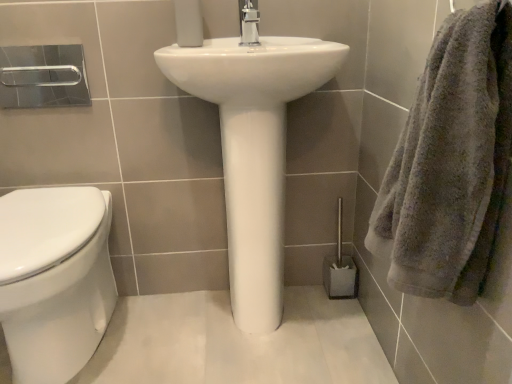
Consider the image. In order to face white glossy toilet at left, should I rotate leftwards or rightwards?

You should look left and rotate roughly 27.112 degrees.

At what (x,y) coordinates should I click in order to perform the action: click on white glossy sink at center. Please return your answer as a coordinate pair (x, y). The height and width of the screenshot is (384, 512). Looking at the image, I should click on (253, 149).

The image size is (512, 384). What do you see at coordinates (340, 269) in the screenshot? I see `gray plastic toilet brush at lower right` at bounding box center [340, 269].

Where is `white matte toilet paper at upper center`? white matte toilet paper at upper center is located at coordinates (188, 23).

You are a GUI agent. You are given a task and a screenshot of the screen. Output one action in this format:
    pyautogui.click(x=<x>, y=<y>)
    Task: Click on the polished chrome faucet at center
    Image resolution: width=512 pixels, height=384 pixels.
    Given the screenshot: What is the action you would take?
    pyautogui.click(x=249, y=22)

Are gray fluffy towel at right and white glossy toilet at left beside each other?

They are not placed beside each other.

Can you confirm if gray fluffy towel at right is positioned to the left of white glossy toilet at left?

No.

Is gray fluffy towel at right thinner than white glossy toilet at left?

Indeed, gray fluffy towel at right has a lesser width compared to white glossy toilet at left.

Could you tell me if gray fluffy towel at right is facing white glossy toilet at left?

No, gray fluffy towel at right is not turned towards white glossy toilet at left.

Is white glossy sink at center turned away from white glossy toilet at left?

No, white glossy sink at center is not facing away from white glossy toilet at left.

Considering the relative positions of white glossy sink at center and white glossy toilet at left in the image provided, is white glossy sink at center behind white glossy toilet at left?

Yes.

Can we say white glossy sink at center lies outside white glossy toilet at left?

Yes, white glossy sink at center is located beyond the bounds of white glossy toilet at left.

Is there a large distance between white glossy sink at center and white glossy toilet at left?

No, white glossy sink at center is not far from white glossy toilet at left.

Is white glossy toilet at left completely or partially outside of gray fluffy towel at right?

Indeed, white glossy toilet at left is completely outside gray fluffy towel at right.

From a real-world perspective, is white glossy toilet at left above or below gray fluffy towel at right?

In terms of real-world spatial position, white glossy toilet at left is below gray fluffy towel at right.

Are white glossy toilet at left and gray fluffy towel at right located far from each other?

No, there isn't a large distance between white glossy toilet at left and gray fluffy towel at right.

The width and height of the screenshot is (512, 384). I want to click on towel above the white glossy toilet at left (from the image's perspective), so click(451, 162).

Is white glossy sink at center positioned before gray fluffy towel at right?

No, the depth of white glossy sink at center is greater than that of gray fluffy towel at right.

Between white glossy sink at center and gray fluffy towel at right, which one appears on the left side from the viewer's perspective?

white glossy sink at center is more to the left.

Consider the image. Can gray fluffy towel at right be found inside white glossy sink at center?

That's incorrect, gray fluffy towel at right is not inside white glossy sink at center.

Consider the image. Can you tell me how much white glossy sink at center and gray fluffy towel at right differ in facing direction?

88.5 degrees.

Considering the relative positions of white matte toilet paper at upper center and white glossy toilet at left in the image provided, is white matte toilet paper at upper center to the right of white glossy toilet at left from the viewer's perspective?

Yes, white matte toilet paper at upper center is to the right of white glossy toilet at left.

Is white matte toilet paper at upper center positioned with its back to white glossy toilet at left?

No, white matte toilet paper at upper center's orientation is not away from white glossy toilet at left.

From the image's perspective, relative to white glossy toilet at left, is white matte toilet paper at upper center above or below?

white matte toilet paper at upper center is situated higher than white glossy toilet at left in the image.

Looking at this image, is white matte toilet paper at upper center positioned behind white glossy toilet at left?

Yes, the depth of white matte toilet paper at upper center is greater than that of white glossy toilet at left.

Is gray fluffy towel at right placed right next to polished chrome faucet at center?

No, gray fluffy towel at right is not next to polished chrome faucet at center.

From a real-world perspective, is gray fluffy towel at right positioned under polished chrome faucet at center based on gravity?

Correct, in the physical world, gray fluffy towel at right is lower than polished chrome faucet at center.

Locate an element on the screen. towel that appears below the polished chrome faucet at center (from the image's perspective) is located at coordinates (451, 162).

Which object is positioned more to the left, gray fluffy towel at right or polished chrome faucet at center?

From the viewer's perspective, polished chrome faucet at center appears more on the left side.

Find the location of a particular element. This screenshot has height=384, width=512. sink that appears below the polished chrome faucet at center (from a real-world perspective) is located at coordinates (253, 149).

Is polished chrome faucet at center completely or partially outside of white glossy sink at center?

Yes, polished chrome faucet at center is outside of white glossy sink at center.

Considering the relative positions of polished chrome faucet at center and white glossy sink at center in the image provided, is polished chrome faucet at center to the left of white glossy sink at center from the viewer's perspective?

Yes.

Locate an element on the screen. towel located above the white glossy toilet at left (from the image's perspective) is located at coordinates (451, 162).

The height and width of the screenshot is (384, 512). What are the coordinates of `sink that is above the white glossy toilet at left (from a real-world perspective)` in the screenshot? It's located at (253, 149).

Looking at the image, which one is located further to gray plastic toilet brush at lower right, polished chrome faucet at center or white glossy toilet at left?

Among the two, white glossy toilet at left is located further to gray plastic toilet brush at lower right.

Considering their positions, is white glossy toilet at left positioned further to white glossy sink at center than white matte toilet paper at upper center?

The object further to white glossy sink at center is white glossy toilet at left.

Which object lies nearer to the anchor point white glossy sink at center, white matte toilet paper at upper center or white glossy toilet at left?

white matte toilet paper at upper center is closer to white glossy sink at center.

Based on their spatial positions, is white matte toilet paper at upper center or polished chrome faucet at center closer to white glossy toilet at left?

The object closer to white glossy toilet at left is white matte toilet paper at upper center.

From the image, which object appears to be nearer to white glossy toilet at left, white glossy sink at center or polished chrome faucet at center?

white glossy sink at center is closer to white glossy toilet at left.

From the image, which object appears to be nearer to polished chrome faucet at center, white glossy toilet at left or gray plastic toilet brush at lower right?

gray plastic toilet brush at lower right lies closer to polished chrome faucet at center than the other object.

Considering their positions, is gray fluffy towel at right positioned further to polished chrome faucet at center than white matte toilet paper at upper center?

gray fluffy towel at right.

When comparing their distances from gray fluffy towel at right, does white glossy sink at center or white matte toilet paper at upper center seem further?

white matte toilet paper at upper center.

This screenshot has height=384, width=512. Find the location of `toilet paper situated between white glossy toilet at left and gray plastic toilet brush at lower right from left to right`. toilet paper situated between white glossy toilet at left and gray plastic toilet brush at lower right from left to right is located at coordinates (188, 23).

Locate an element on the screen. tap positioned between gray fluffy towel at right and gray plastic toilet brush at lower right from near to far is located at coordinates (249, 22).

Find the location of a particular element. toilet paper between white glossy toilet at left and gray fluffy towel at right is located at coordinates (188, 23).

At what (x,y) coordinates should I click in order to perform the action: click on tap between white matte toilet paper at upper center and white glossy toilet at left from top to bottom. Please return your answer as a coordinate pair (x, y). Looking at the image, I should click on (249, 22).